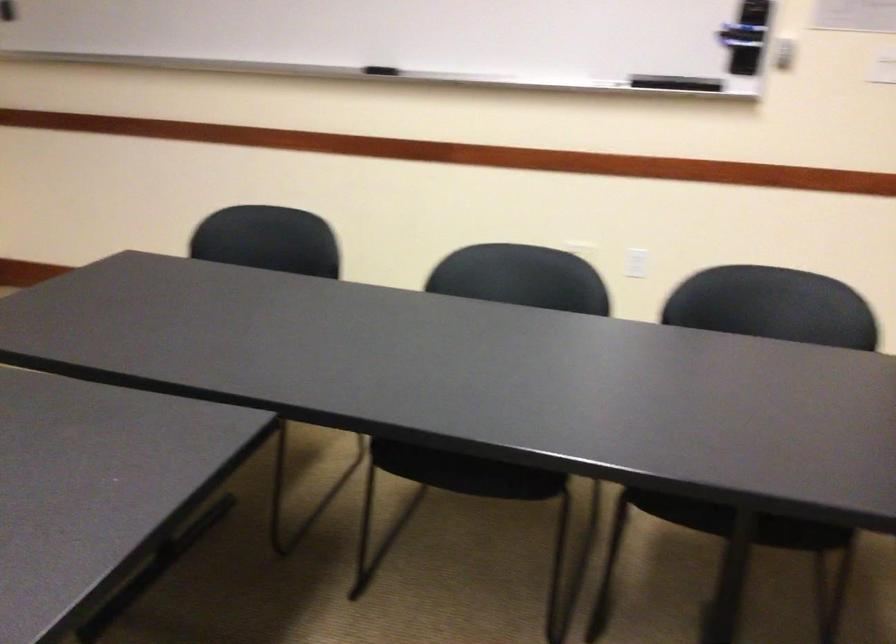
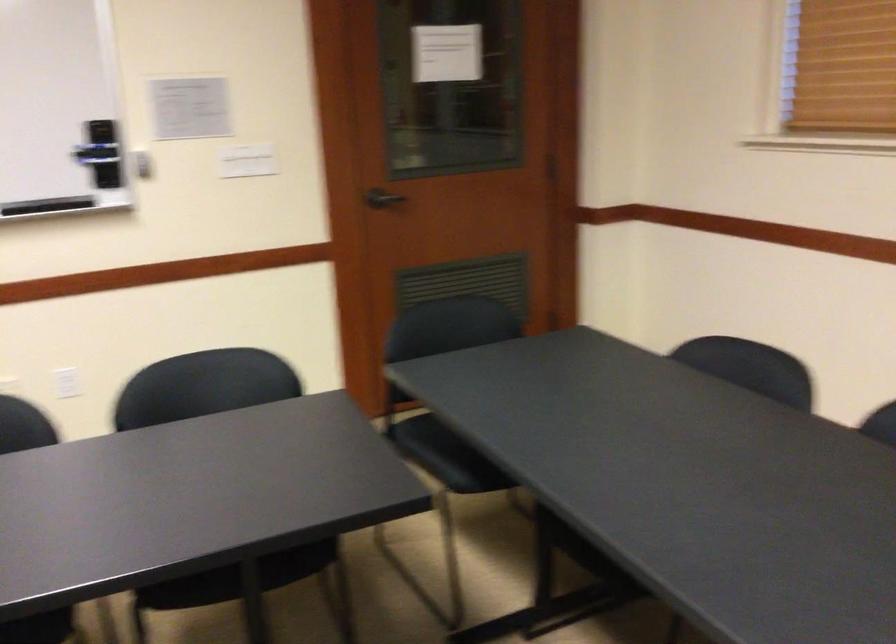
Locate, in the second image, the point that corresponds to [767,305] in the first image.

(218, 381)